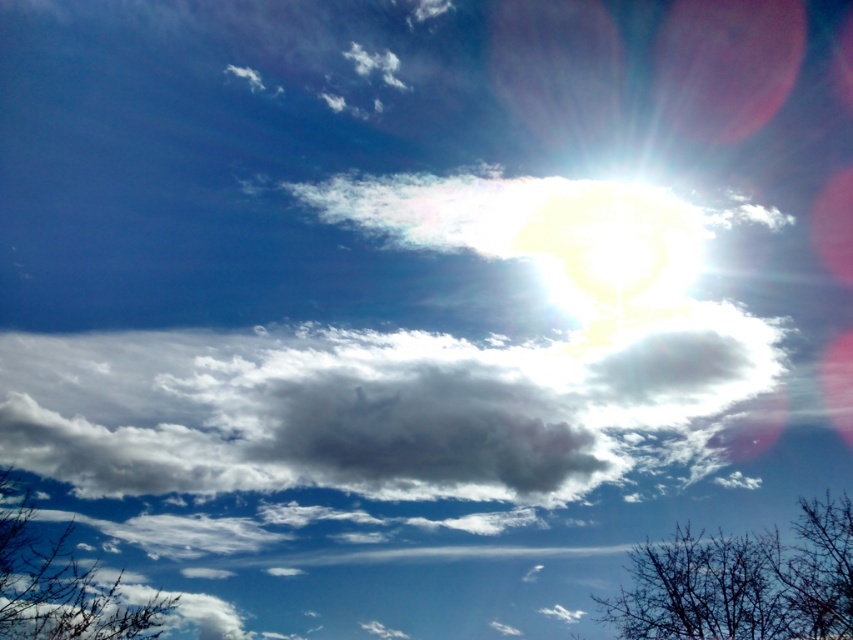
Question: Can you confirm if white fluffy cloud at center is wider than brown textured branches at lower left?

Choices:
 (A) no
 (B) yes

Answer: (B)

Question: Among these points, which one is farthest from the camera?

Choices:
 (A) (602, 346)
 (B) (676, 548)

Answer: (B)

Question: Is white fluffy cloud at center closer to the viewer compared to bare branches at lower right?

Choices:
 (A) no
 (B) yes

Answer: (B)

Question: Which object is farther from the camera taking this photo?

Choices:
 (A) white fluffy cloud at center
 (B) bare branches at lower right
 (C) brown textured branches at lower left

Answer: (B)

Question: Does white fluffy cloud at center appear on the left side of brown textured branches at lower left?

Choices:
 (A) no
 (B) yes

Answer: (A)

Question: Estimate the real-world distances between objects in this image. Which object is farther from the white fluffy cloud at center?

Choices:
 (A) brown textured branches at lower left
 (B) bare branches at lower right

Answer: (B)